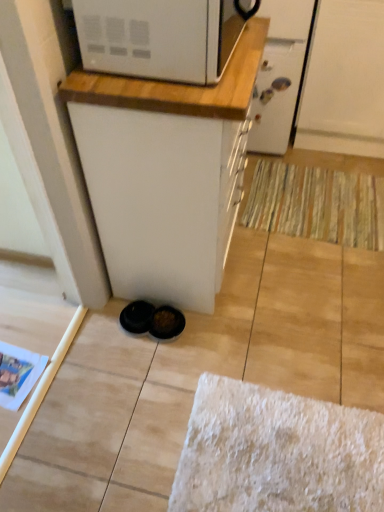
Question: Looking at the image, does white wood countertop at upper center seem bigger or smaller compared to white glossy screen door at upper center, which ranks as the second screen door in right-to-left order?

Choices:
 (A) big
 (B) small

Answer: (B)

Question: From the image's perspective, is white wood countertop at upper center located above or below white glossy screen door at upper center, which ranks as the second screen door in right-to-left order?

Choices:
 (A) above
 (B) below

Answer: (B)

Question: Considering the real-world distances, which object is closest to the white glossy screen door at upper center, positioned as the 1th screen door in left-to-right order?

Choices:
 (A) white wood countertop at upper center
 (B) striped fabric doormat at lower right
 (C) white matte screen door at upper right, placed as the 2th screen door when sorted from left to right
 (D) white matte cabinet at center

Answer: (C)

Question: Considering the real-world distances, which object is farthest from the white glossy screen door at upper center, positioned as the 1th screen door in left-to-right order?

Choices:
 (A) white wood countertop at upper center
 (B) white matte screen door at upper right, placed as the 2th screen door when sorted from left to right
 (C) striped fabric doormat at lower right
 (D) white matte cabinet at center

Answer: (D)